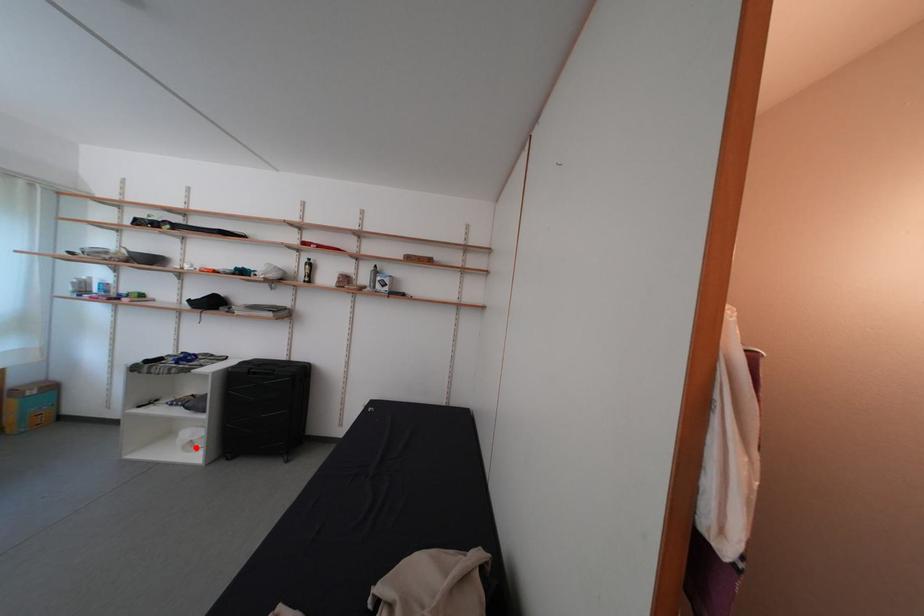
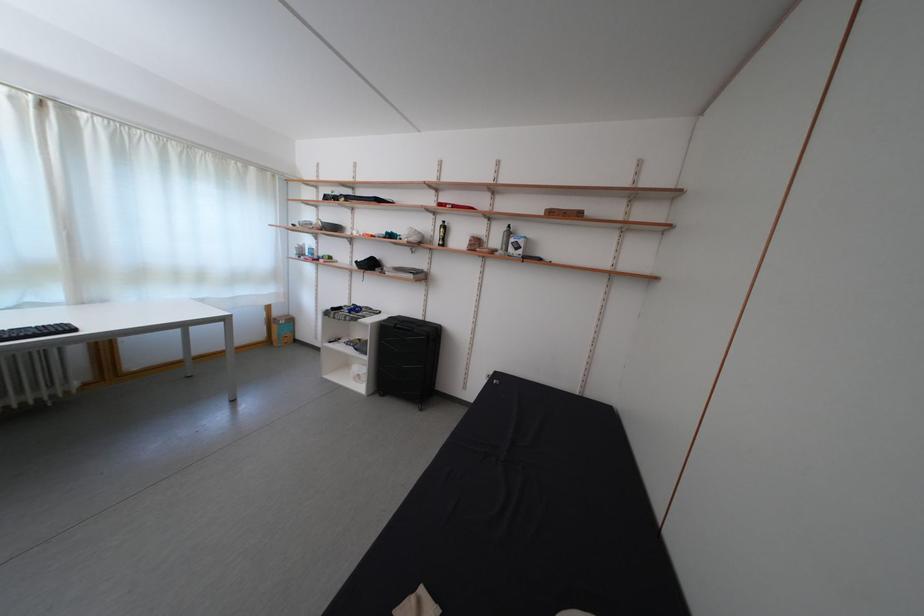
The point at the highlighted location is marked in the first image. Where is the corresponding point in the second image?

(365, 381)